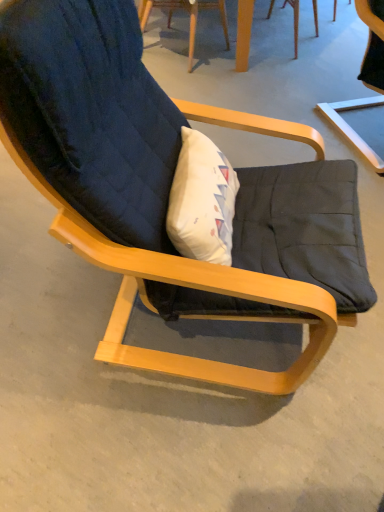
Question: Considering the relative sizes of wooden table at upper center and matte black cushion at center, which is counted as the 1th chair, starting from the right, in the image provided, is wooden table at upper center wider than matte black cushion at center, which is counted as the 1th chair, starting from the right,?

Choices:
 (A) yes
 (B) no

Answer: (B)

Question: Is wooden table at upper center turned away from matte black cushion at center, which is counted as the 1th chair, starting from the right?

Choices:
 (A) yes
 (B) no

Answer: (B)

Question: Would you consider wooden table at upper center to be distant from matte black cushion at center, which ranks as the second chair in left-to-right order?

Choices:
 (A) no
 (B) yes

Answer: (A)

Question: Can you confirm if wooden table at upper center is positioned to the right of matte black cushion at center, which ranks as the second chair in left-to-right order?

Choices:
 (A) no
 (B) yes

Answer: (A)

Question: From the image's perspective, is wooden table at upper center below matte black cushion at center, which is counted as the 1th chair, starting from the right?

Choices:
 (A) no
 (B) yes

Answer: (A)

Question: Can you confirm if wooden table at upper center is smaller than matte black cushion at center, which is counted as the 1th chair, starting from the right?

Choices:
 (A) yes
 (B) no

Answer: (A)

Question: Is dark blue fabric chair at upper center, placed as the first chair when sorted from left to right, in contact with matte black cushion at center, which ranks as the second chair in left-to-right order?

Choices:
 (A) yes
 (B) no

Answer: (B)

Question: From the image's perspective, would you say dark blue fabric chair at upper center, placed as the first chair when sorted from left to right, is shown under matte black cushion at center, which is counted as the 1th chair, starting from the right?

Choices:
 (A) yes
 (B) no

Answer: (B)

Question: Is dark blue fabric chair at upper center, the second chair when ordered from right to left, positioned far away from matte black cushion at center, which is counted as the 1th chair, starting from the right?

Choices:
 (A) yes
 (B) no

Answer: (B)

Question: Is dark blue fabric chair at upper center, placed as the first chair when sorted from left to right, positioned before matte black cushion at center, which is counted as the 1th chair, starting from the right?

Choices:
 (A) yes
 (B) no

Answer: (B)

Question: Would you say matte black cushion at center, which is counted as the 1th chair, starting from the right, is part of dark blue fabric chair at upper center, the second chair when ordered from right to left,'s contents?

Choices:
 (A) yes
 (B) no

Answer: (B)

Question: From a real-world perspective, is dark blue fabric chair at upper center, the second chair when ordered from right to left, physically above matte black cushion at center, which ranks as the second chair in left-to-right order?

Choices:
 (A) yes
 (B) no

Answer: (B)

Question: Is dark blue fabric chair at upper center, placed as the first chair when sorted from left to right, at the right side of wooden table at upper center?

Choices:
 (A) no
 (B) yes

Answer: (A)